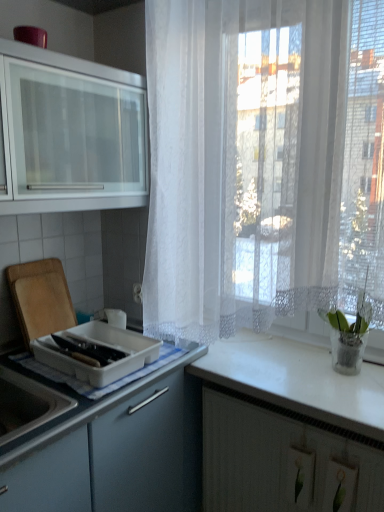
The image size is (384, 512). Identify the location of white matte cabinet at lower right, which is the 1th cabinetry in bottom-to-top order. (281, 461).

Measure the distance between white plastic container at left and camera.

A: white plastic container at left and camera are 4.17 feet apart from each other.

The height and width of the screenshot is (512, 384). What do you see at coordinates (72, 133) in the screenshot?
I see `matte glass cabinet at upper left, the first cabinetry when ordered from top to bottom` at bounding box center [72, 133].

Measure the distance between matte glass cabinet at upper left, marked as the second cabinetry in a right-to-left arrangement, and camera.

matte glass cabinet at upper left, marked as the second cabinetry in a right-to-left arrangement, is 1.19 meters from camera.

Describe the element at coordinates (349, 334) in the screenshot. I see `green glass vase at right` at that location.

Locate an element on the screen. This screenshot has height=512, width=384. white matte cabinet at lower right, the second cabinetry from the top is located at coordinates (281, 461).

Does white glossy countertop at right have a smaller size compared to white plastic container at left?

No.

In the scene shown: Who is more distant, white glossy countertop at right or white plastic container at left?

white plastic container at left.

Which is correct: white glossy countertop at right is inside white plastic container at left, or outside of it?

white glossy countertop at right lies outside white plastic container at left.

Who is bigger, white matte cabinet at lower right, the 1th cabinetry positioned from the right, or white lace curtain at right?

Bigger between the two is white lace curtain at right.

Can you tell me how much white matte cabinet at lower right, which is the 1th cabinetry in bottom-to-top order, and white lace curtain at right differ in facing direction?

0.483 degrees.

Can you confirm if white matte cabinet at lower right, the second cabinetry from the top, is wider than white lace curtain at right?

No, white matte cabinet at lower right, the second cabinetry from the top, is not wider than white lace curtain at right.

Consider the image. In terms of height, does white matte cabinet at lower right, which is counted as the 2th cabinetry, starting from the left, look taller or shorter compared to white lace curtain at right?

white matte cabinet at lower right, which is counted as the 2th cabinetry, starting from the left, is shorter than white lace curtain at right.

What's the angular difference between white lace curtain at right and matte glass cabinet at upper left, the 2th cabinetry positioned from the bottom,'s facing directions?

89.6 degrees separate the facing orientations of white lace curtain at right and matte glass cabinet at upper left, the 2th cabinetry positioned from the bottom.

Which object is more forward, white lace curtain at right or matte glass cabinet at upper left, the 2th cabinetry positioned from the bottom?

white lace curtain at right is in front.

Is white lace curtain at right positioned far away from matte glass cabinet at upper left, placed as the 1th cabinetry when sorted from left to right?

No, white lace curtain at right is not far away from matte glass cabinet at upper left, placed as the 1th cabinetry when sorted from left to right.

Is white plastic container at left closer to the viewer compared to white glossy countertop at right?

No, the depth of white plastic container at left is greater than that of white glossy countertop at right.

Can you confirm if white plastic container at left is shorter than white glossy countertop at right?

Incorrect, the height of white plastic container at left does not fall short of that of white glossy countertop at right.

In the scene shown: From the image's perspective, is white plastic container at left above or below white glossy countertop at right?

From the image's perspective, white plastic container at left appears above white glossy countertop at right.

From a real-world perspective, is white plastic container at left located higher than white glossy countertop at right?

Yes.

Is white glossy countertop at right to the left of white matte cabinet at lower right, the 1th cabinetry positioned from the right, from the viewer's perspective?

Yes.

Considering their positions, is white glossy countertop at right located in front of or behind white matte cabinet at lower right, which is the 1th cabinetry in bottom-to-top order?

white glossy countertop at right is positioned closer to the viewer than white matte cabinet at lower right, which is the 1th cabinetry in bottom-to-top order.

Looking at this image, from a real-world perspective, is white glossy countertop at right on white matte cabinet at lower right, which is counted as the 2th cabinetry, starting from the left?

Yes, from a real-world perspective, white glossy countertop at right is over white matte cabinet at lower right, which is counted as the 2th cabinetry, starting from the left

Considering the relative sizes of white glossy countertop at right and white matte cabinet at lower right, which is the 1th cabinetry in bottom-to-top order, in the image provided, is white glossy countertop at right bigger than white matte cabinet at lower right, which is the 1th cabinetry in bottom-to-top order,?

Correct, white glossy countertop at right is larger in size than white matte cabinet at lower right, which is the 1th cabinetry in bottom-to-top order.

Which is more to the left, white lace curtain at right or white plastic container at left?

From the viewer's perspective, white plastic container at left appears more on the left side.

Is white lace curtain at right positioned behind white plastic container at left?

That is False.

Is white lace curtain at right next to white plastic container at left?

white lace curtain at right is not next to white plastic container at left, and they're not touching.

How different are the orientations of white matte cabinet at lower right, which is the 1th cabinetry in bottom-to-top order, and matte glass cabinet at upper left, the 2th cabinetry positioned from the bottom, in degrees?

white matte cabinet at lower right, which is the 1th cabinetry in bottom-to-top order, and matte glass cabinet at upper left, the 2th cabinetry positioned from the bottom, are facing 89.1 degrees away from each other.

Considering the relative positions of white matte cabinet at lower right, the second cabinetry from the top, and matte glass cabinet at upper left, marked as the second cabinetry in a right-to-left arrangement, in the image provided, is white matte cabinet at lower right, the second cabinetry from the top, to the left of matte glass cabinet at upper left, marked as the second cabinetry in a right-to-left arrangement, from the viewer's perspective?

No.

From a real-world perspective, which is physically below, white matte cabinet at lower right, which is counted as the 2th cabinetry, starting from the left, or matte glass cabinet at upper left, the 2th cabinetry positioned from the bottom?

From a 3D spatial view, white matte cabinet at lower right, which is counted as the 2th cabinetry, starting from the left, is below.

Who is shorter, white matte cabinet at lower right, which is counted as the 2th cabinetry, starting from the left, or matte glass cabinet at upper left, marked as the second cabinetry in a right-to-left arrangement?

white matte cabinet at lower right, which is counted as the 2th cabinetry, starting from the left.

At what (x,y) coordinates should I click in order to perform the action: click on countertop located below the white plastic container at left (from the image's perspective). Please return your answer as a coordinate pair (x, y). The width and height of the screenshot is (384, 512). Looking at the image, I should click on (297, 380).

Locate an element on the screen. The image size is (384, 512). cabinetry that is the 2nd one when counting backward from the white lace curtain at right is located at coordinates (281, 461).

Based on their spatial positions, is green glass vase at right or white glossy countertop at right further from white plastic container at left?

Among the two, green glass vase at right is located further to white plastic container at left.

From the image, which object appears to be nearer to white glossy countertop at right, white lace curtain at right or white matte cabinet at lower right, the 1th cabinetry positioned from the right?

The object closer to white glossy countertop at right is white matte cabinet at lower right, the 1th cabinetry positioned from the right.

From the image, which object appears to be farther from white plastic container at left, white lace curtain at right or white matte cabinet at lower right, the second cabinetry from the top?

Based on the image, white lace curtain at right appears to be further to white plastic container at left.

Looking at the image, which one is located closer to white lace curtain at right, green glass vase at right or white glossy countertop at right?

green glass vase at right lies closer to white lace curtain at right than the other object.

From the image, which object appears to be farther from white matte cabinet at lower right, which is the 1th cabinetry in bottom-to-top order, green glass vase at right or white plastic container at left?

Among the two, white plastic container at left is located further to white matte cabinet at lower right, which is the 1th cabinetry in bottom-to-top order.

Considering their positions, is matte glass cabinet at upper left, the 2th cabinetry positioned from the bottom, positioned closer to white plastic container at left than white matte cabinet at lower right, the 1th cabinetry positioned from the right?

white matte cabinet at lower right, the 1th cabinetry positioned from the right, is positioned closer to the anchor white plastic container at left.

Considering their positions, is white glossy countertop at right positioned closer to green glass vase at right than matte glass cabinet at upper left, marked as the second cabinetry in a right-to-left arrangement?

The object closer to green glass vase at right is white glossy countertop at right.

Based on their spatial positions, is white plastic container at left or white glossy countertop at right further from white lace curtain at right?

white plastic container at left.

This screenshot has width=384, height=512. Find the location of `houseplant between matte glass cabinet at upper left, placed as the 1th cabinetry when sorted from left to right, and white matte cabinet at lower right, the second cabinetry from the top, in the vertical direction`. houseplant between matte glass cabinet at upper left, placed as the 1th cabinetry when sorted from left to right, and white matte cabinet at lower right, the second cabinetry from the top, in the vertical direction is located at coordinates (349, 334).

Locate an element on the screen. Image resolution: width=384 pixels, height=512 pixels. countertop that lies between matte glass cabinet at upper left, the 2th cabinetry positioned from the bottom, and white matte cabinet at lower right, which is the 1th cabinetry in bottom-to-top order, from top to bottom is located at coordinates (297, 380).

Locate an element on the screen. This screenshot has height=512, width=384. houseplant between matte glass cabinet at upper left, placed as the 1th cabinetry when sorted from left to right, and white glossy countertop at right vertically is located at coordinates (349, 334).

You are a GUI agent. You are given a task and a screenshot of the screen. Output one action in this format:
    pyautogui.click(x=<x>, y=<y>)
    Task: Click on the curtain between matte glass cabinet at upper left, the first cabinetry when ordered from top to bottom, and white plastic container at left, in the vertical direction
    Image resolution: width=384 pixels, height=512 pixels.
    Given the screenshot: What is the action you would take?
    pyautogui.click(x=262, y=162)